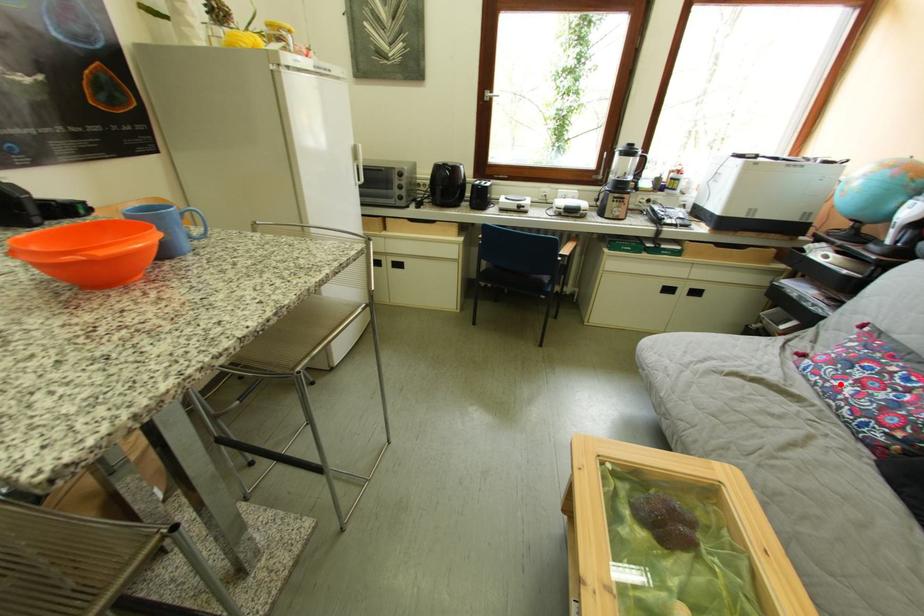
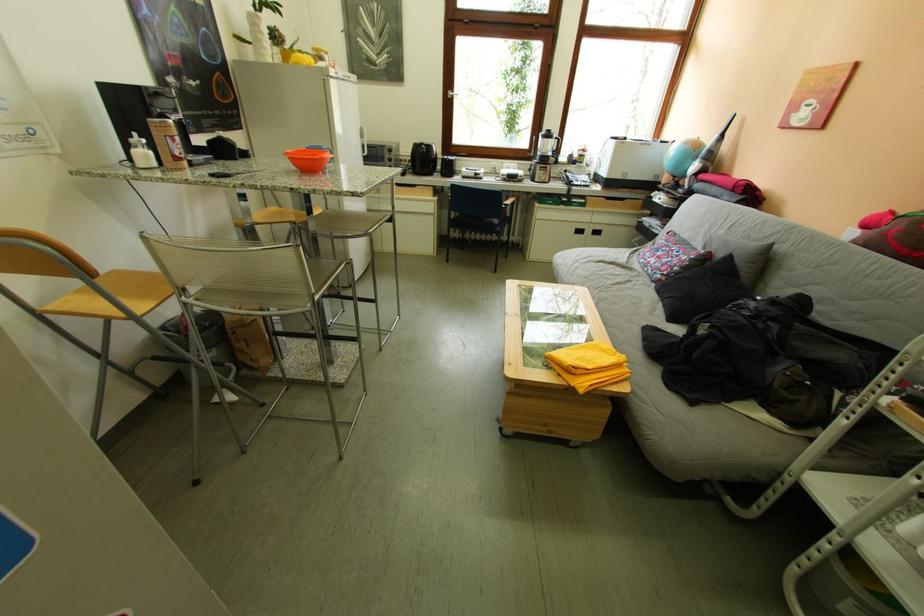
Question: A red point is marked in image1. In image2, is the corresponding 3D point closer to the camera or farther? Reply with the corresponding letter.

Choices:
 (A) The corresponding 3D point is closer.
 (B) The corresponding 3D point is farther.

Answer: (A)